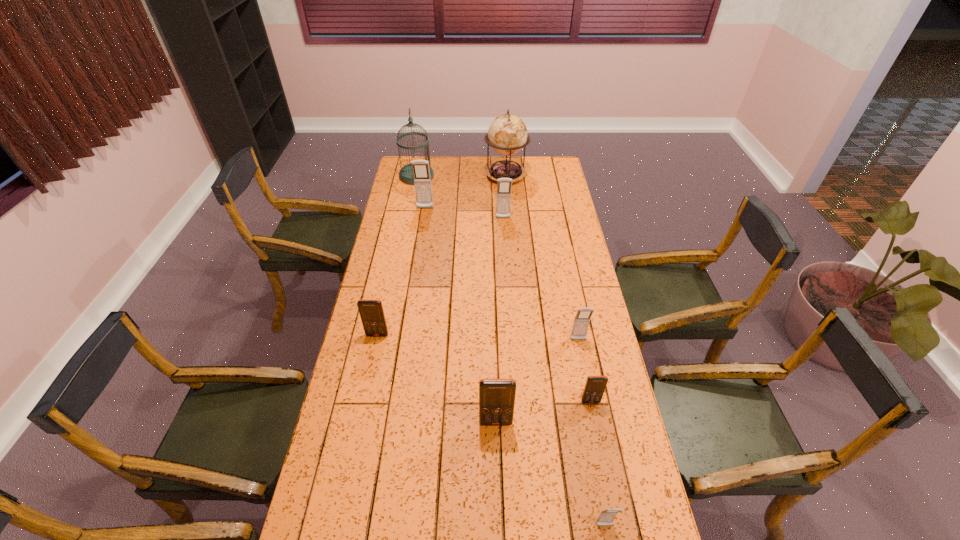
Where is `vacant space situated 0.360m on the front-facing side of the third farthest gray cellular telephone`? vacant space situated 0.360m on the front-facing side of the third farthest gray cellular telephone is located at coordinates (598, 441).

Where is `free space located on the screen of the second biggest orange cellular telephone`? free space located on the screen of the second biggest orange cellular telephone is located at coordinates (360, 418).

You are a GUI agent. You are given a task and a screenshot of the screen. Output one action in this format:
    pyautogui.click(x=<x>, y=<y>)
    Task: Click on the free space located on the screen of the rightmost orange cellular telephone
    
    Given the screenshot: What is the action you would take?
    pyautogui.click(x=612, y=510)

The height and width of the screenshot is (540, 960). What are the coordinates of `birdcage at the far edge` in the screenshot? It's located at (406, 176).

Image resolution: width=960 pixels, height=540 pixels. Identify the location of globe located at the far edge. tap(507, 134).

Image resolution: width=960 pixels, height=540 pixels. What are the coordinates of `birdcage located in the left edge section of the desktop` in the screenshot? It's located at (406, 176).

I want to click on object present at the far left corner, so click(406, 176).

At what (x,y) coordinates should I click in order to perform the action: click on vacant area at the left edge. Please return your answer as a coordinate pair (x, y). This screenshot has height=540, width=960. Looking at the image, I should click on (389, 278).

Locate an element on the screen. This screenshot has height=540, width=960. blank space at the right edge of the desktop is located at coordinates (575, 306).

Where is `blank space at the far right corner of the desktop`? blank space at the far right corner of the desktop is located at coordinates (541, 171).